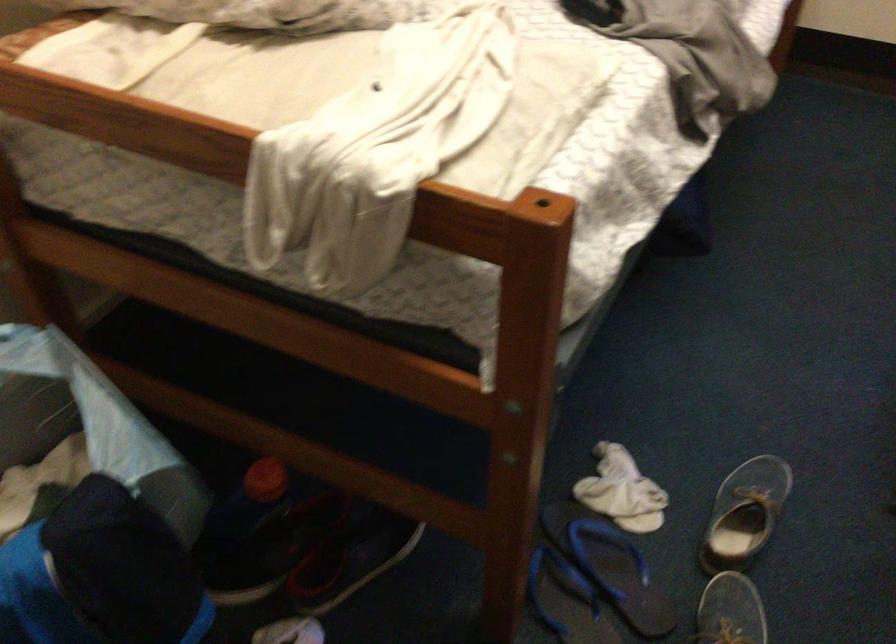
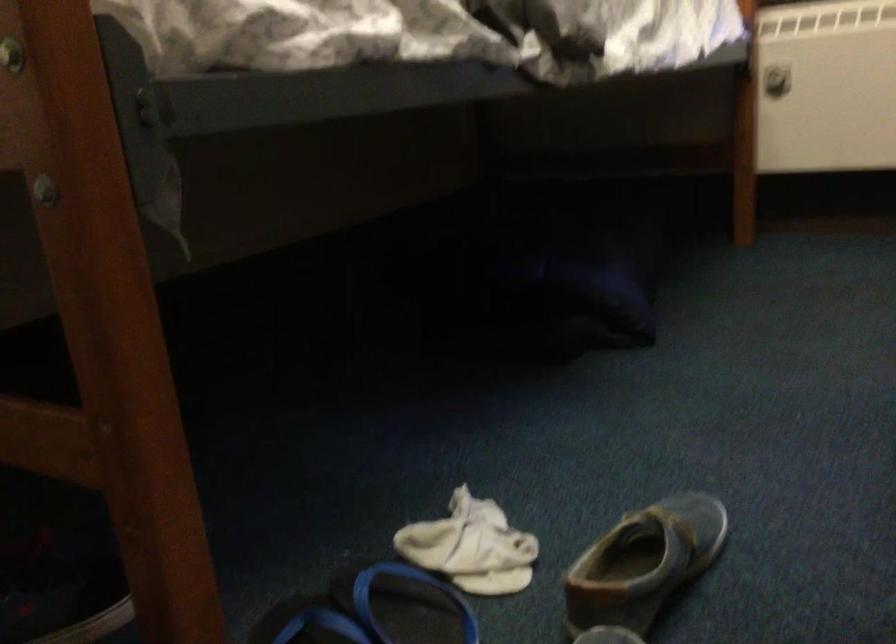
In the second image, find the point that corresponds to point 597,544 in the first image.

(406, 605)